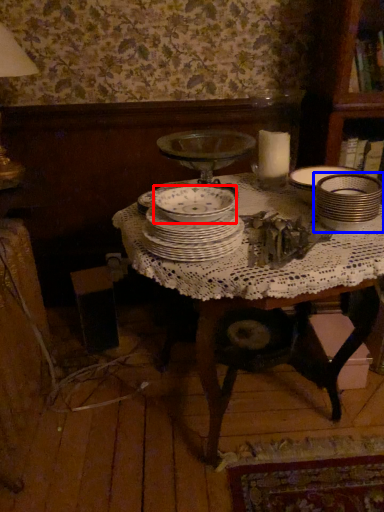
Question: Which of the following is the farthest to the observer, bowl (highlighted by a red box) or tableware (highlighted by a blue box)?

Choices:
 (A) bowl
 (B) tableware

Answer: (B)